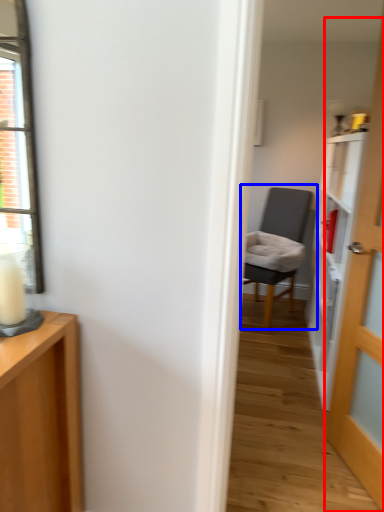
Question: Which of the following is the closest to the observer, door (highlighted by a red box) or chair (highlighted by a blue box)?

Choices:
 (A) door
 (B) chair

Answer: (A)